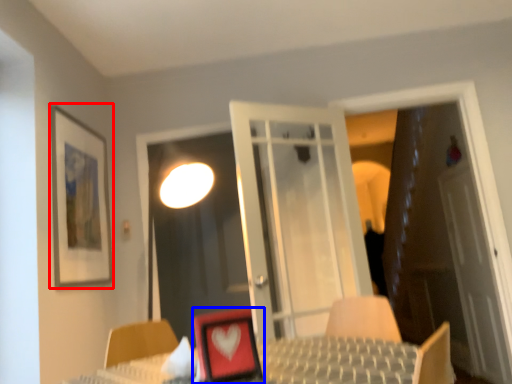
Question: Which object is closer to the camera taking this photo, picture frame (highlighted by a red box) or picture frame (highlighted by a blue box)?

Choices:
 (A) picture frame
 (B) picture frame

Answer: (B)